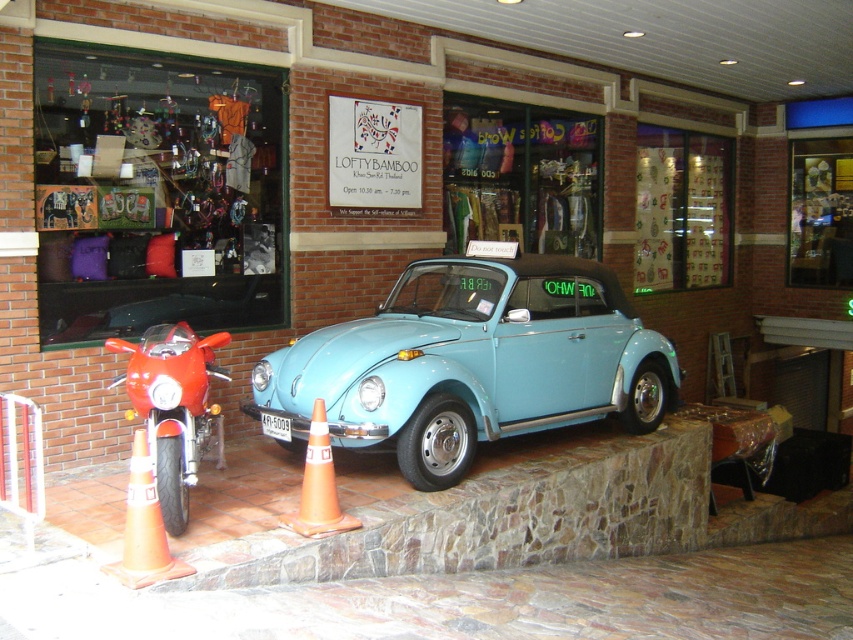
You are a customer approaching the store and see the orange plastic traffic cone at lower left and the orange plastic traffic cone at lower center. Which cone is closer to the ground?

The orange plastic traffic cone at lower left is located below the orange plastic traffic cone at lower center, so it is closer to the ground.

You are standing at the entrance of Lofty Bamboo store and want to take a photo of the light blue matte car at center. Which direction should you face to capture the car in your shot?

Since the light blue matte car at center is located at point (473, 362), you should face towards the center of the image to capture it in your photo.